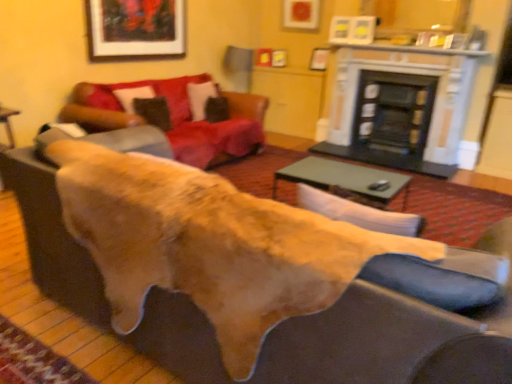
Question: From the image's perspective, is black glass fireplace at center, the 1th fireplace positioned from the right, located beneath velvet red couch at upper center?

Choices:
 (A) no
 (B) yes

Answer: (A)

Question: Does black glass fireplace at center, which appears as the second fireplace when viewed from the left, have a smaller size compared to velvet red couch at upper center?

Choices:
 (A) yes
 (B) no

Answer: (A)

Question: Is black glass fireplace at center, which appears as the second fireplace when viewed from the left, in front of velvet red couch at upper center?

Choices:
 (A) no
 (B) yes

Answer: (A)

Question: Is black glass fireplace at center, which appears as the second fireplace when viewed from the left, thinner than velvet red couch at upper center?

Choices:
 (A) no
 (B) yes

Answer: (B)

Question: Does black glass fireplace at center, the 1th fireplace positioned from the right, come behind velvet red couch at upper center?

Choices:
 (A) no
 (B) yes

Answer: (B)

Question: Is wooden framed artwork at upper center bigger or smaller than black marble fireplace at upper center, acting as the 2th fireplace starting from the right?

Choices:
 (A) big
 (B) small

Answer: (B)

Question: Is wooden framed artwork at upper center in front of or behind black marble fireplace at upper center, the 1th fireplace in the left-to-right sequence, in the image?

Choices:
 (A) behind
 (B) front

Answer: (B)

Question: In terms of height, does wooden framed artwork at upper center look taller or shorter compared to black marble fireplace at upper center, acting as the 2th fireplace starting from the right?

Choices:
 (A) tall
 (B) short

Answer: (B)

Question: Would you say wooden framed artwork at upper center is to the left or to the right of black marble fireplace at upper center, acting as the 2th fireplace starting from the right, in the picture?

Choices:
 (A) right
 (B) left

Answer: (B)

Question: Does point (134, 6) appear closer or farther from the camera than point (202, 89)?

Choices:
 (A) farther
 (B) closer

Answer: (B)

Question: Is wooden framed artwork at upper center bigger or smaller than velvet brown pillow at center, arranged as the first pillow when viewed from the back?

Choices:
 (A) small
 (B) big

Answer: (B)

Question: Considering the positions of wooden framed artwork at upper center and velvet brown pillow at center, marked as the second pillow in a front-to-back arrangement, in the image, is wooden framed artwork at upper center taller or shorter than velvet brown pillow at center, marked as the second pillow in a front-to-back arrangement,?

Choices:
 (A) tall
 (B) short

Answer: (A)

Question: Looking at their shapes, would you say wooden framed artwork at upper center is wider or thinner than velvet brown pillow at center, acting as the 2th pillow starting from the left?

Choices:
 (A) wide
 (B) thin

Answer: (B)

Question: Is brown suede pillow at upper left, positioned as the first pillow in left-to-right order, taller or shorter than wooden framed artwork at upper center?

Choices:
 (A) tall
 (B) short

Answer: (B)

Question: In the image, is brown suede pillow at upper left, which is the 1th pillow from front to back, on the left side or the right side of wooden framed artwork at upper center?

Choices:
 (A) left
 (B) right

Answer: (B)